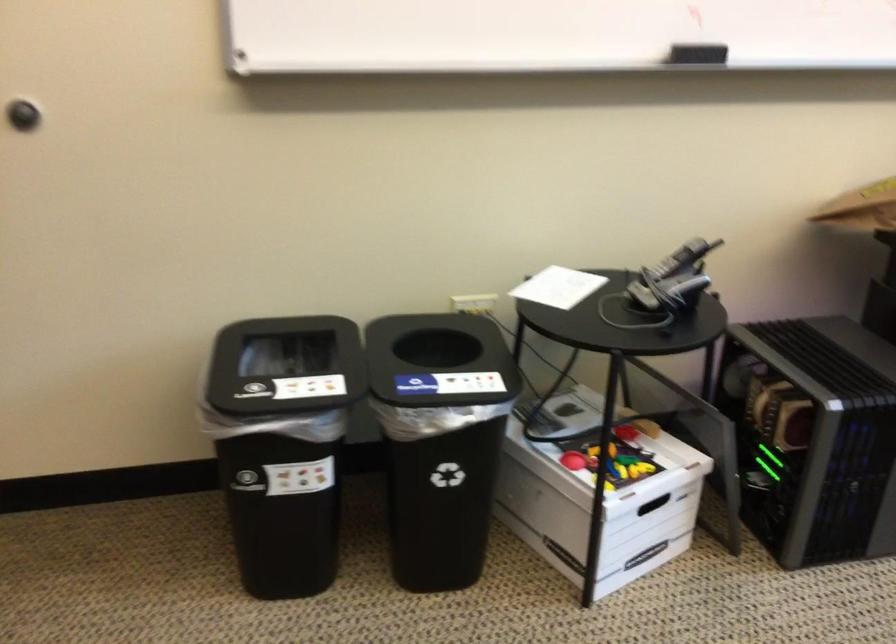
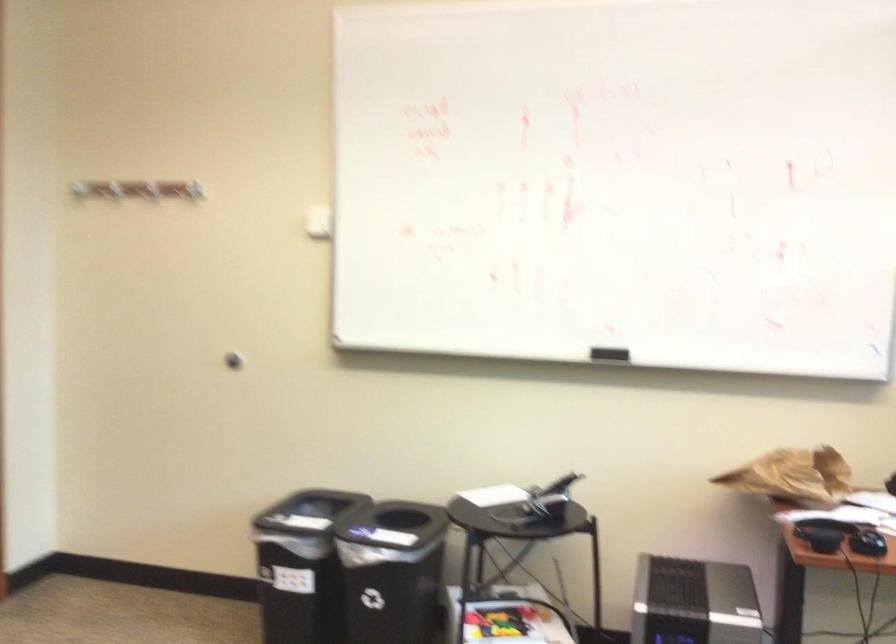
Find the pixel in the second image that matches [438,361] in the first image.

(426, 541)